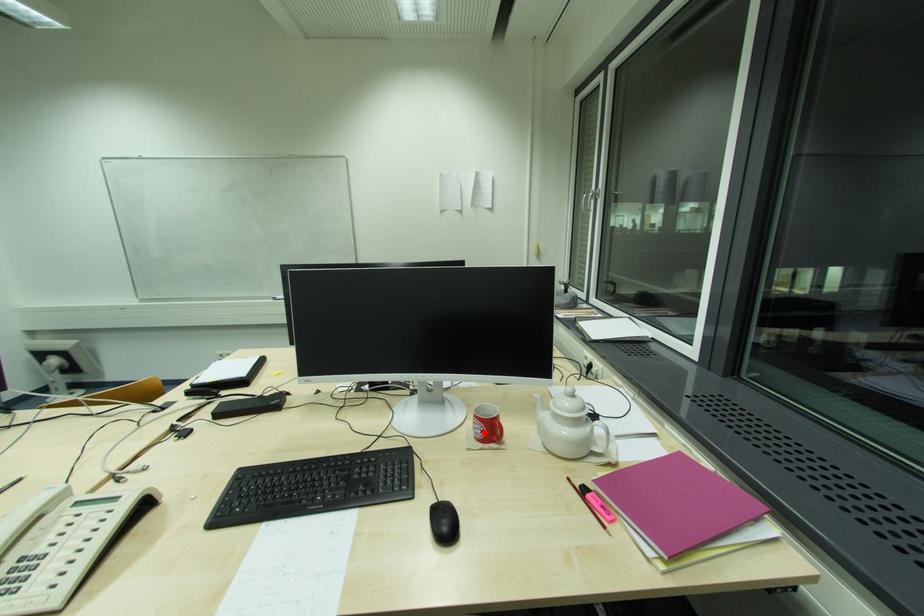
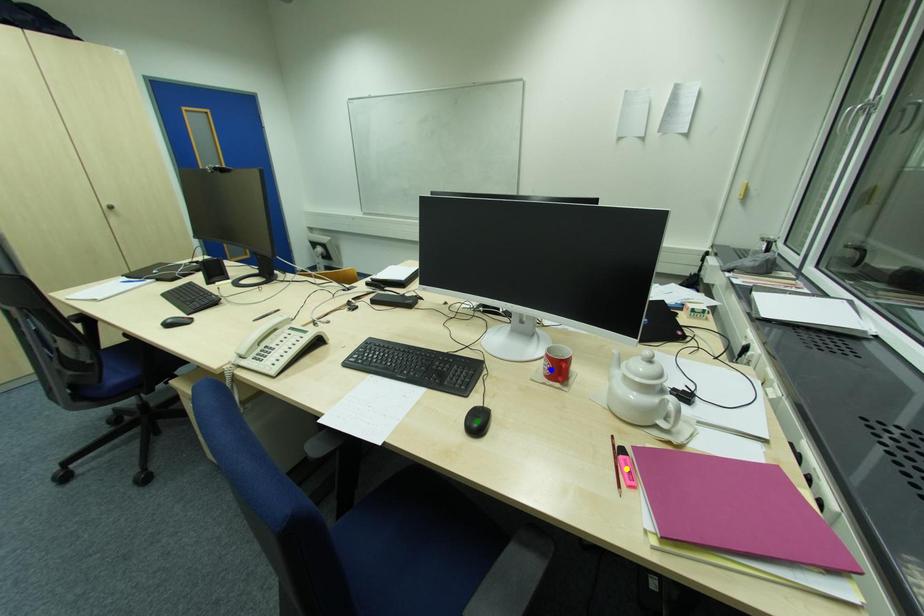
Question: I am providing you with two images of the same scene from different viewpoints. A red point is marked on the first image. You are given multiple points on the second image. In image 2, which mark is for the same physical point as the one in image 1?

Choices:
 (A) green point
 (B) yellow point
 (C) blue point

Answer: (C)